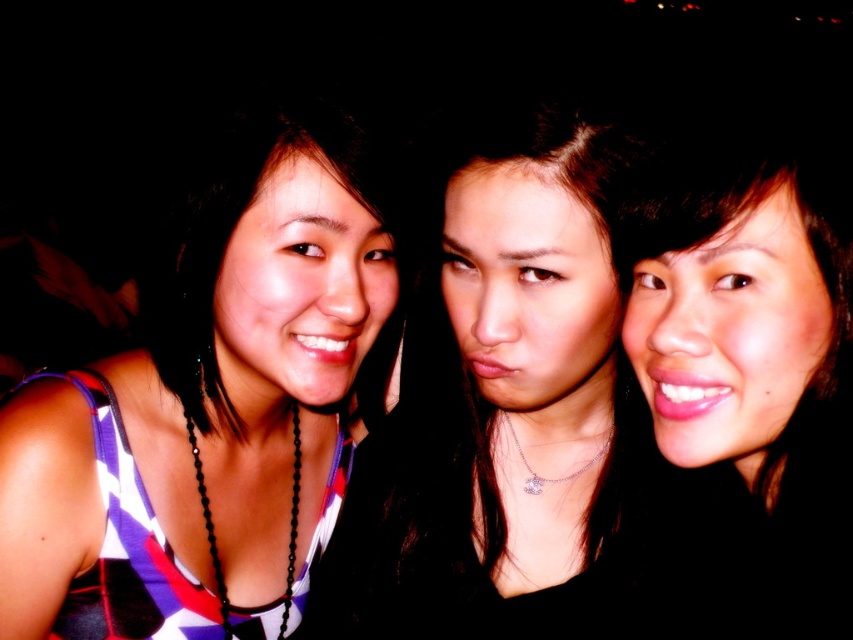
Can you confirm if smooth black hair at center is taller than smooth skin at center?

Yes, smooth black hair at center is taller than smooth skin at center.

Can you confirm if smooth black hair at center is thinner than smooth skin at center?

In fact, smooth black hair at center might be wider than smooth skin at center.

Is point (643, 465) less distant than point (744, 202)?

That is False.

Image resolution: width=853 pixels, height=640 pixels. What are the coordinates of `smooth black hair at center` in the screenshot? It's located at (503, 394).

In the scene shown: Between striped fabric dress at left and smooth black hair at center, which one has less height?

With less height is smooth black hair at center.

Does striped fabric dress at left appear on the right side of smooth black hair at center?

Incorrect, striped fabric dress at left is not on the right side of smooth black hair at center.

The width and height of the screenshot is (853, 640). Identify the location of striped fabric dress at left. (212, 408).

Is striped fabric dress at left shorter than smooth skin at center?

Incorrect, striped fabric dress at left's height does not fall short of smooth skin at center's.

At what (x,y) coordinates should I click in order to perform the action: click on striped fabric dress at left. Please return your answer as a coordinate pair (x, y). This screenshot has height=640, width=853. Looking at the image, I should click on (212, 408).

Locate an element on the screen. The image size is (853, 640). striped fabric dress at left is located at coordinates (212, 408).